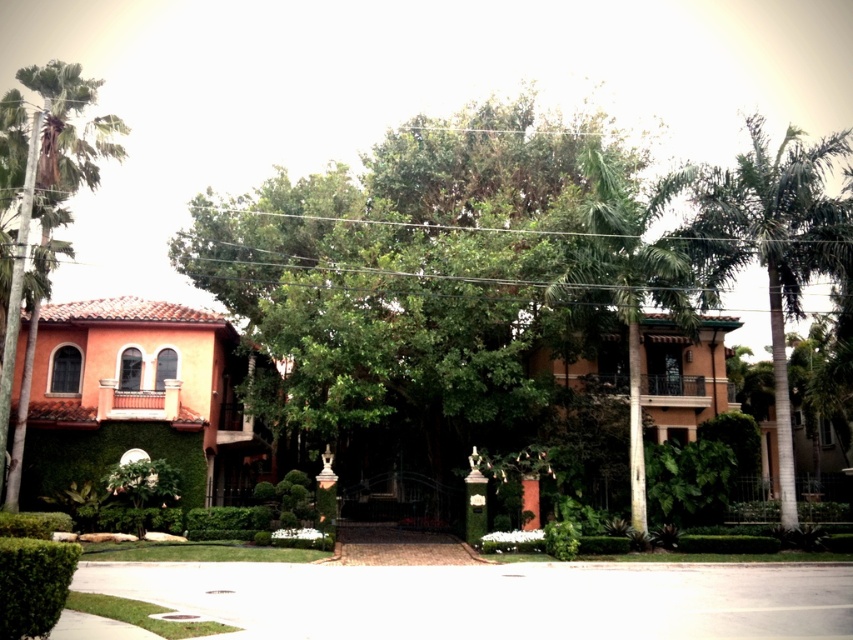
You are standing at the entrance of the house and want to walk towards the green leafy tree at center and the green leafy palm tree at center. Which tree will you reach first?

The green leafy tree at center is closer to you than the green leafy palm tree at center, so you will reach the green leafy tree at center first.

You are a landscape architect planning to install a new bench in the front yard of the house. Considering the green leafy tree at center and the green leafy palm tree at center, which tree is taller and would cast more shade? Please choose between the two.

The green leafy tree at center is taller than the green leafy palm tree at center, so it would cast more shade.